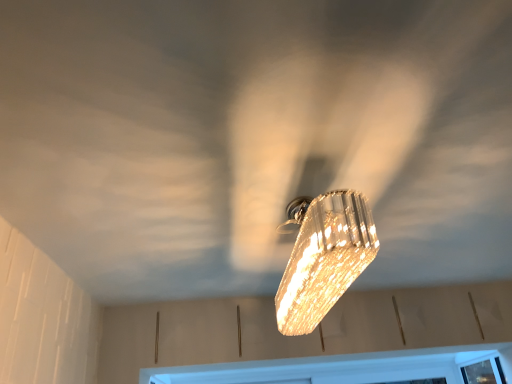
Question: Is point (293, 205) positioned closer to the camera than point (378, 362)?

Choices:
 (A) closer
 (B) farther

Answer: (A)

Question: Is clear crystal light fixture at center in front of or behind white plastic window frame at bottom in the image?

Choices:
 (A) front
 (B) behind

Answer: (A)

Question: Considering the positions of clear crystal light fixture at center and white plastic window frame at bottom in the image, is clear crystal light fixture at center taller or shorter than white plastic window frame at bottom?

Choices:
 (A) tall
 (B) short

Answer: (A)

Question: Considering the positions of white plastic window frame at bottom and clear crystal light fixture at center in the image, is white plastic window frame at bottom bigger or smaller than clear crystal light fixture at center?

Choices:
 (A) small
 (B) big

Answer: (A)

Question: Would you say white plastic window frame at bottom is inside or outside clear crystal light fixture at center?

Choices:
 (A) outside
 (B) inside

Answer: (A)

Question: Considering the positions of white plastic window frame at bottom and clear crystal light fixture at center in the image, is white plastic window frame at bottom taller or shorter than clear crystal light fixture at center?

Choices:
 (A) short
 (B) tall

Answer: (A)

Question: Does point (500, 374) appear closer or farther from the camera than point (305, 276)?

Choices:
 (A) farther
 (B) closer

Answer: (A)